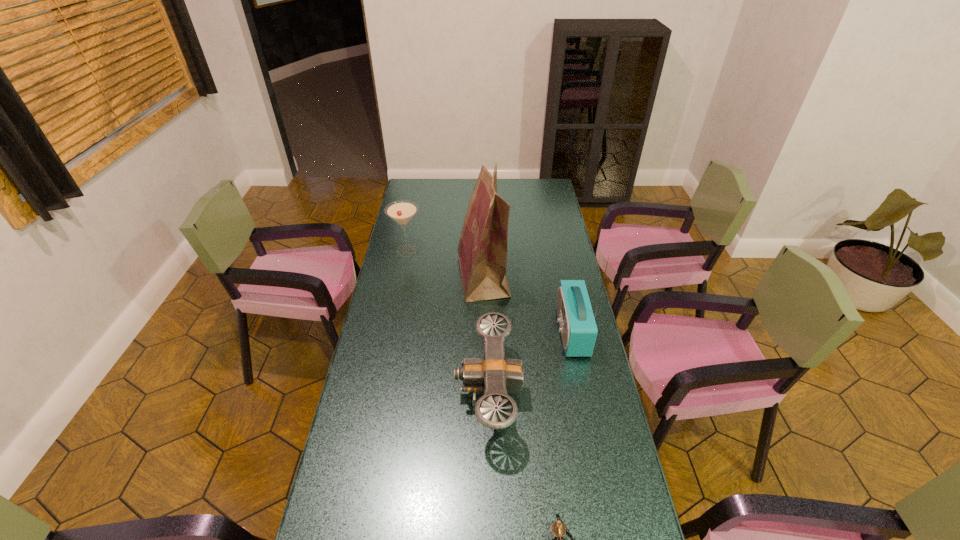
In the image, there is a desktop. Find the location of `vacant space at the far right corner`. vacant space at the far right corner is located at coordinates (551, 178).

Locate an element on the screen. The height and width of the screenshot is (540, 960). vacant area between the third shortest object and the fourth tallest object is located at coordinates (448, 322).

What are the coordinates of `free space between the grocery bag and the radio receiver` in the screenshot? It's located at (527, 304).

Where is `the closest object to the second shortest object`? Image resolution: width=960 pixels, height=540 pixels. the closest object to the second shortest object is located at coordinates (578, 328).

Select which object is the second closest to the leftmost object. Please provide its 2D coordinates. Your answer should be formatted as a tuple, i.e. [(x, y)], where the tuple contains the x and y coordinates of a point satisfying the conditions above.

[(494, 374)]